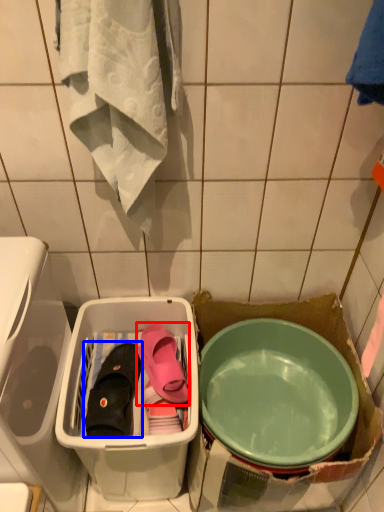
Question: Which point is closer to the camera, footwear (highlighted by a red box) or footwear (highlighted by a blue box)?

Choices:
 (A) footwear
 (B) footwear

Answer: (B)